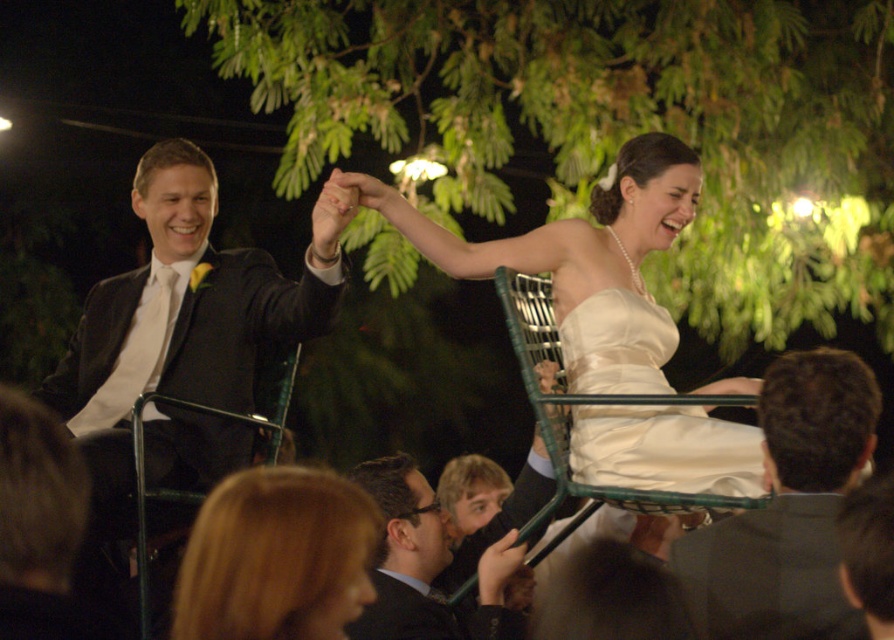
Looking at this image, can you confirm if matte black suit at left is bigger than blonde hair at lower left?

Yes.

Which of these two, matte black suit at left or blonde hair at lower left, stands taller?

With more height is matte black suit at left.

Is point (184, 513) more distant than point (289, 572)?

Yes, point (184, 513) is farther from viewer.

The width and height of the screenshot is (894, 640). What are the coordinates of `matte black suit at left` in the screenshot? It's located at (183, 321).

Between ivory satin dress at center and blonde hair at lower left, which one is positioned lower?

Positioned lower is blonde hair at lower left.

Is point (698, 186) positioned after point (226, 481)?

Yes, it is behind point (226, 481).

Image resolution: width=894 pixels, height=640 pixels. I want to click on ivory satin dress at center, so click(x=571, y=230).

Can you confirm if blonde hair at lower left is positioned to the right of satin white dress at center?

In fact, blonde hair at lower left is to the left of satin white dress at center.

Describe the element at coordinates (276, 557) in the screenshot. The height and width of the screenshot is (640, 894). I see `blonde hair at lower left` at that location.

This screenshot has height=640, width=894. In order to click on blonde hair at lower left in this screenshot , I will do `click(276, 557)`.